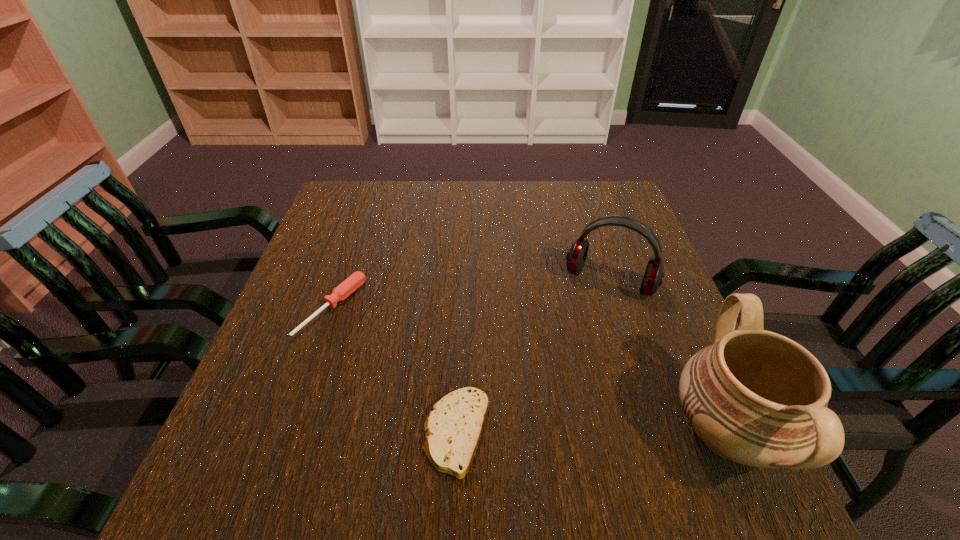
At what (x,y) coordinates should I click in order to perform the action: click on vacant area situated 0.240m on the ear cups of the second tallest object. Please return your answer as a coordinate pair (x, y). Looking at the image, I should click on (566, 382).

Image resolution: width=960 pixels, height=540 pixels. Find the location of `free space located 0.110m on the ear cups of the second tallest object`. free space located 0.110m on the ear cups of the second tallest object is located at coordinates (584, 336).

The width and height of the screenshot is (960, 540). In order to click on free space located on the ear cups of the second tallest object in this screenshot , I will do `click(573, 363)`.

Image resolution: width=960 pixels, height=540 pixels. I want to click on vacant space located at the blade of the screwdriver, so click(386, 342).

Image resolution: width=960 pixels, height=540 pixels. I want to click on vacant region located 0.290m at the blade of the screwdriver, so click(x=462, y=381).

What are the coordinates of `free space located 0.310m at the blade of the screwdriver` in the screenshot? It's located at (470, 386).

Locate an element on the screen. pita bread present at the near edge is located at coordinates (453, 428).

Image resolution: width=960 pixels, height=540 pixels. Find the location of `urn that is at the near edge`. urn that is at the near edge is located at coordinates (755, 397).

Where is `object located in the left edge section of the desktop`? The width and height of the screenshot is (960, 540). object located in the left edge section of the desktop is located at coordinates (347, 287).

I want to click on urn positioned at the right edge, so click(755, 397).